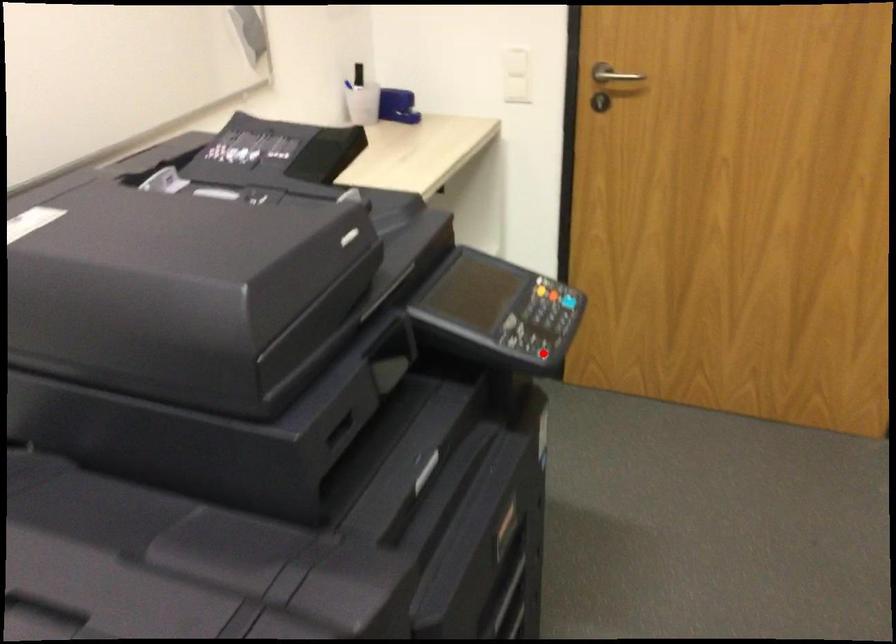
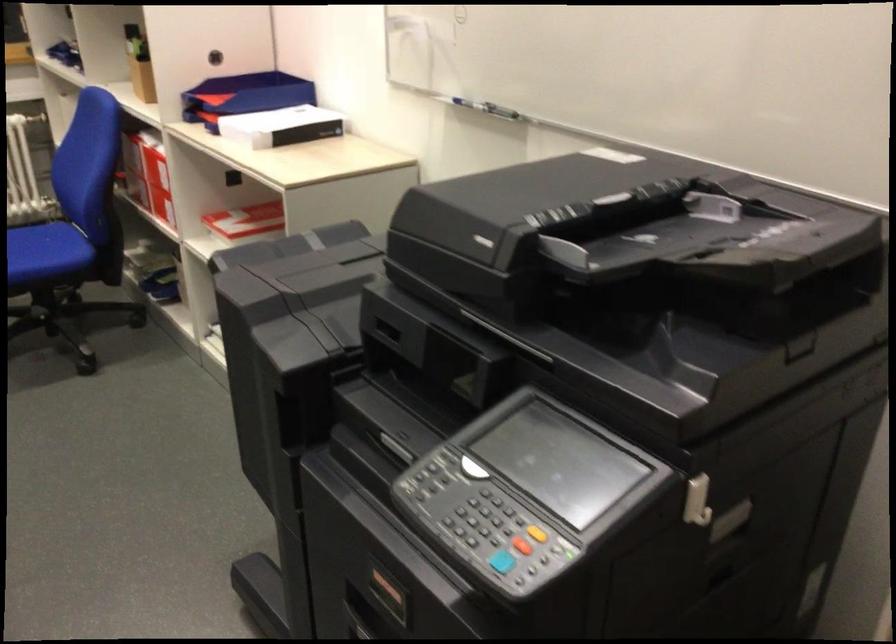
In the second image, find the point that corresponds to the highlighted location in the first image.

(470, 514)